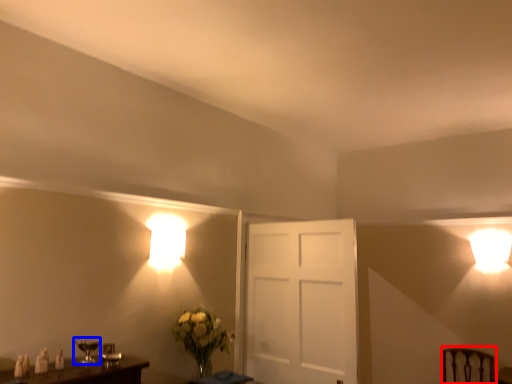
Question: Which of the following is the closest to the observer, swivel chair (highlighted by a red box) or table lamp (highlighted by a blue box)?

Choices:
 (A) swivel chair
 (B) table lamp

Answer: (B)